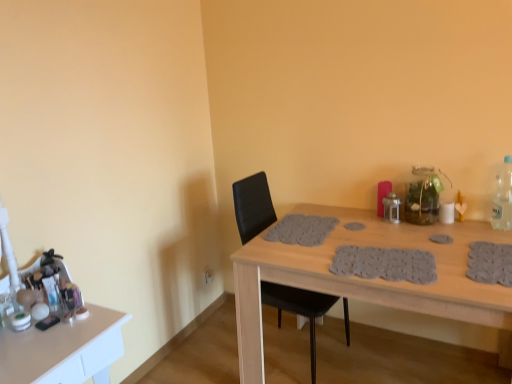
This screenshot has width=512, height=384. I want to click on free space to the left of clear plastic bottle at right, so click(x=470, y=230).